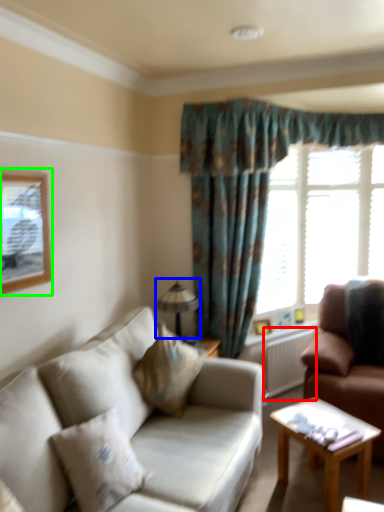
Question: Which object is the closest to the radiator (highlighted by a red box)? Choose among these: lamp (highlighted by a blue box) or picture frame (highlighted by a green box).

Choices:
 (A) lamp
 (B) picture frame

Answer: (A)